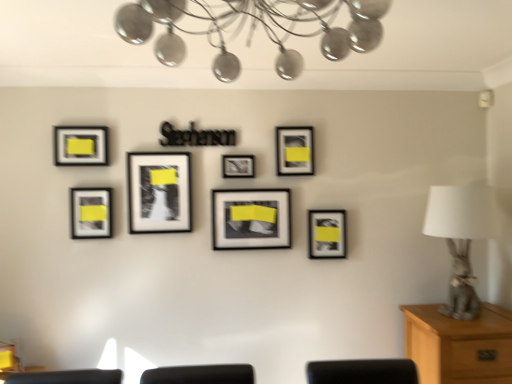
Question: Does matte black picture frame at lower left, which appears as the 6th picture frame when viewed from the right, have a greater width compared to matte black picture frame at center, the 3th picture frame from the right?

Choices:
 (A) yes
 (B) no

Answer: (B)

Question: Is matte black picture frame at center, the fifth picture frame in the left-to-right sequence, at the back of matte black picture frame at lower left, which ranks as the second picture frame in left-to-right order?

Choices:
 (A) yes
 (B) no

Answer: (B)

Question: From a real-world perspective, is matte black picture frame at lower left, which ranks as the second picture frame in left-to-right order, under matte black picture frame at center, the 3th picture frame from the right?

Choices:
 (A) yes
 (B) no

Answer: (B)

Question: Does matte black picture frame at lower left, which ranks as the second picture frame in left-to-right order, have a smaller size compared to matte black picture frame at center, the fifth picture frame in the left-to-right sequence?

Choices:
 (A) no
 (B) yes

Answer: (B)

Question: Is the depth of matte black picture frame at lower left, which appears as the 6th picture frame when viewed from the right, greater than that of matte black picture frame at center, the fifth picture frame in the left-to-right sequence?

Choices:
 (A) no
 (B) yes

Answer: (A)

Question: From their relative heights in the image, would you say matte black picture frame at center, the 5th picture frame from the right, is taller or shorter than matte black picture frame at center, marked as the fourth picture frame in a left-to-right arrangement?

Choices:
 (A) short
 (B) tall

Answer: (B)

Question: Would you say matte black picture frame at center, acting as the third picture frame starting from the left, is to the left or to the right of matte black picture frame at center, placed as the 4th picture frame when sorted from right to left, in the picture?

Choices:
 (A) left
 (B) right

Answer: (A)

Question: Based on their sizes in the image, would you say matte black picture frame at center, the 5th picture frame from the right, is bigger or smaller than matte black picture frame at center, placed as the 4th picture frame when sorted from right to left?

Choices:
 (A) small
 (B) big

Answer: (B)

Question: Is point (156, 195) positioned closer to the camera than point (232, 167)?

Choices:
 (A) farther
 (B) closer

Answer: (B)

Question: From a real-world perspective, relative to matte black picture frame at center, marked as the fourth picture frame in a left-to-right arrangement, is matte black picture frame at lower right, the first picture frame in the right-to-left sequence, vertically above or below?

Choices:
 (A) above
 (B) below

Answer: (B)

Question: Considering the positions of matte black picture frame at lower right, the seventh picture frame viewed from the left, and matte black picture frame at center, marked as the fourth picture frame in a left-to-right arrangement, in the image, is matte black picture frame at lower right, the seventh picture frame viewed from the left, wider or thinner than matte black picture frame at center, marked as the fourth picture frame in a left-to-right arrangement,?

Choices:
 (A) wide
 (B) thin

Answer: (A)

Question: Considering the positions of matte black picture frame at lower right, the first picture frame in the right-to-left sequence, and matte black picture frame at center, marked as the fourth picture frame in a left-to-right arrangement, in the image, is matte black picture frame at lower right, the first picture frame in the right-to-left sequence, bigger or smaller than matte black picture frame at center, marked as the fourth picture frame in a left-to-right arrangement,?

Choices:
 (A) small
 (B) big

Answer: (B)

Question: Does point (330, 241) appear closer or farther from the camera than point (246, 172)?

Choices:
 (A) farther
 (B) closer

Answer: (A)

Question: From the image's perspective, is metallic chandelier at upper center located above or below matte black picture frame at lower left, which appears as the 6th picture frame when viewed from the right?

Choices:
 (A) below
 (B) above

Answer: (B)

Question: Based on their sizes in the image, would you say metallic chandelier at upper center is bigger or smaller than matte black picture frame at lower left, which appears as the 6th picture frame when viewed from the right?

Choices:
 (A) big
 (B) small

Answer: (A)